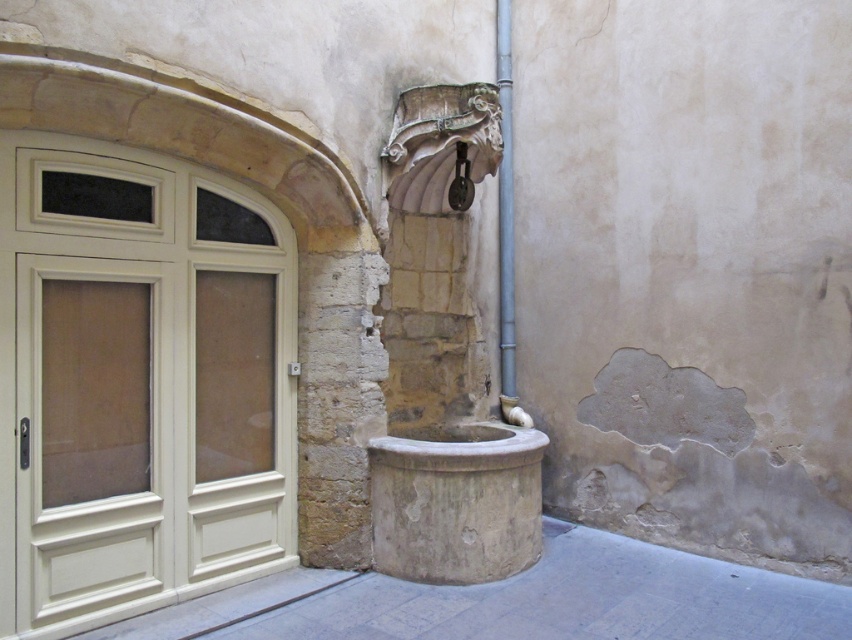
Question: Is white painted wood screen door at left bigger than metallic pipe at center-right?

Choices:
 (A) yes
 (B) no

Answer: (A)

Question: Does white painted wood screen door at left appear on the right side of metallic pipe at center-right?

Choices:
 (A) no
 (B) yes

Answer: (A)

Question: Which point is farther to the camera?

Choices:
 (A) white painted wood screen door at left
 (B) metallic pipe at center-right

Answer: (B)

Question: Can you confirm if white matte screen door at left is wider than metallic pipe at center-right?

Choices:
 (A) no
 (B) yes

Answer: (B)

Question: Which of the following is the farthest from the observer?

Choices:
 (A) (42, 552)
 (B) (117, 390)

Answer: (B)

Question: Which object is closer to the camera taking this photo?

Choices:
 (A) white painted wood screen door at left
 (B) white matte screen door at left
 (C) metallic pipe at center-right

Answer: (A)